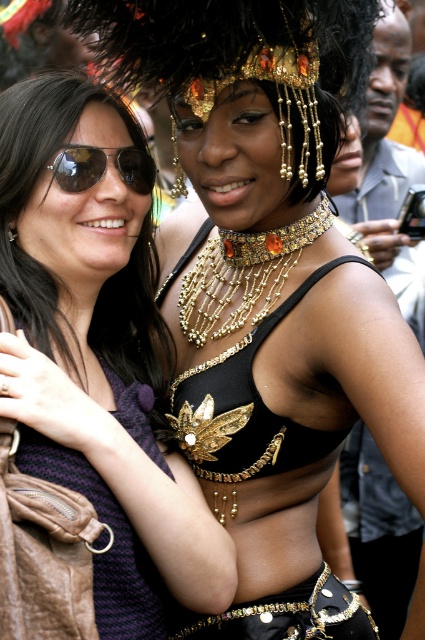
What are the coordinates of the gold beaded necklace at center?

The gold beaded necklace at center is located at coordinates (243, 275).

You are taking a photo of the two people in the scene. You want to focus on the person closer to the camera. Which point should you focus on, point A at position (51,582) or point B at position (229,298)?

Point A at position (51,582) is closer to the camera than point B at position (229,298), so you should focus on point A at position (51,582).

You are a photographer at a cultural event. You want to capture a photo of the purple knitted dress at left and the gold beaded necklace at center. Which object should you focus on first if you want to ensure both are in frame?

The purple knitted dress at left is below the gold beaded necklace at center, so you should focus on the gold beaded necklace at center first to ensure both are in frame.